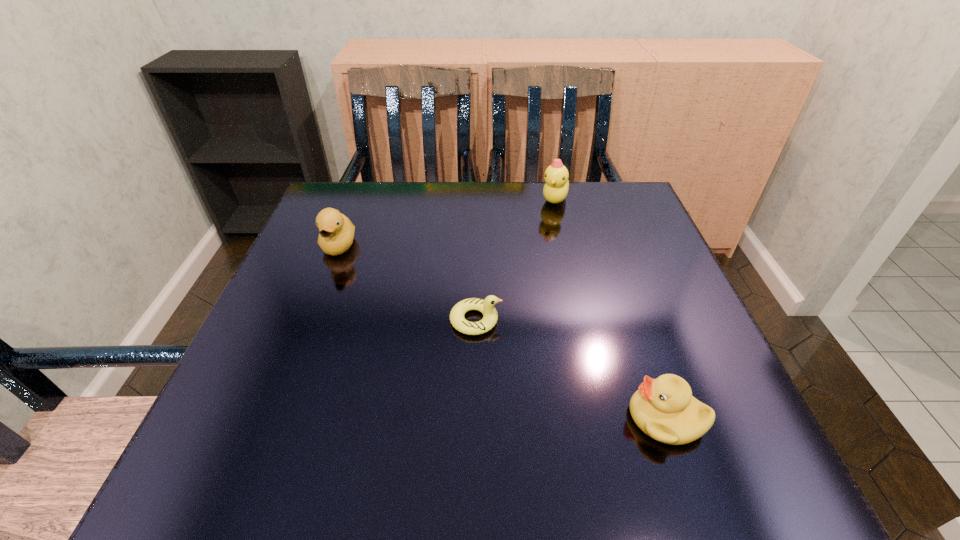
At what (x,y) coordinates should I click in order to perform the action: click on vacant space that's between the shortest duckling and the leftmost duckling. Please return your answer as a coordinate pair (x, y). This screenshot has width=960, height=540. Looking at the image, I should click on (407, 283).

This screenshot has height=540, width=960. I want to click on vacant point located between the second duckling from left to right and the leftmost object, so click(x=407, y=283).

Find the location of a particular element. This screenshot has width=960, height=540. blank region between the second nearest object and the leftmost object is located at coordinates (407, 283).

Image resolution: width=960 pixels, height=540 pixels. Find the location of `vacant point located between the second nearest object and the farthest object`. vacant point located between the second nearest object and the farthest object is located at coordinates (516, 260).

Where is `free space between the second farthest object and the second duckling from left to right`? free space between the second farthest object and the second duckling from left to right is located at coordinates (407, 283).

Locate which object is the second closest to the rightmost object. Please provide its 2D coordinates. Your answer should be formatted as a tuple, i.e. [(x, y)], where the tuple contains the x and y coordinates of a point satisfying the conditions above.

[(555, 190)]

Locate an element on the screen. object that ranks as the third closest to the shortest duckling is located at coordinates (555, 190).

The width and height of the screenshot is (960, 540). Find the location of `duckling identified as the third closest to the second object from right to left`. duckling identified as the third closest to the second object from right to left is located at coordinates (663, 408).

Locate an element on the screen. duckling that is the third closest to the second farthest object is located at coordinates (663, 408).

Find the location of a particular element. Image resolution: width=960 pixels, height=540 pixels. free location that satisfies the following two spatial constraints: 1. on the front-facing side of the farthest duckling; 2. on the face of the second duckling from left to right is located at coordinates (583, 320).